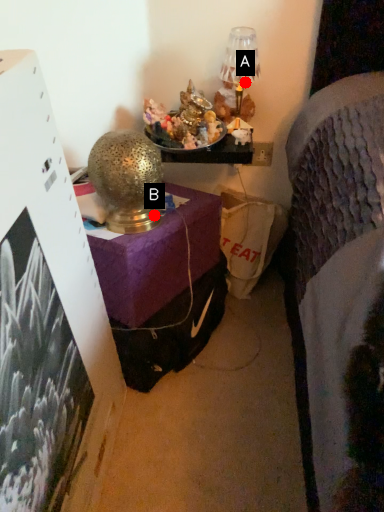
Question: Two points are circled on the image, labeled by A and B beside each circle. Which of the following is the farthest from the observer?

Choices:
 (A) A is further
 (B) B is further

Answer: (A)